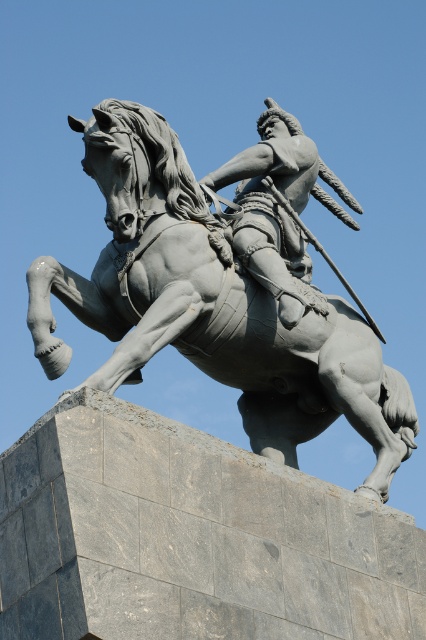
Question: Does gray stone statue at center have a larger size compared to polished bronze rider at center?

Choices:
 (A) yes
 (B) no

Answer: (A)

Question: Does gray stone statue at center have a larger size compared to polished bronze rider at center?

Choices:
 (A) no
 (B) yes

Answer: (B)

Question: Does gray stone statue at center come behind polished bronze rider at center?

Choices:
 (A) yes
 (B) no

Answer: (B)

Question: Which point is farther to the camera?

Choices:
 (A) polished bronze rider at center
 (B) gray stone statue at center

Answer: (A)

Question: Which point is farther to the camera?

Choices:
 (A) (256, 266)
 (B) (169, 236)

Answer: (A)